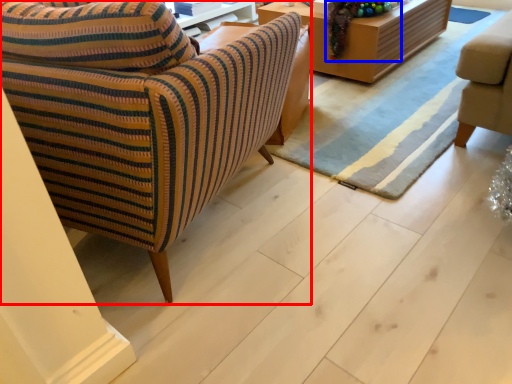
Question: Which object is further to the camera taking this photo, chair (highlighted by a red box) or christmas decoration (highlighted by a blue box)?

Choices:
 (A) chair
 (B) christmas decoration

Answer: (B)